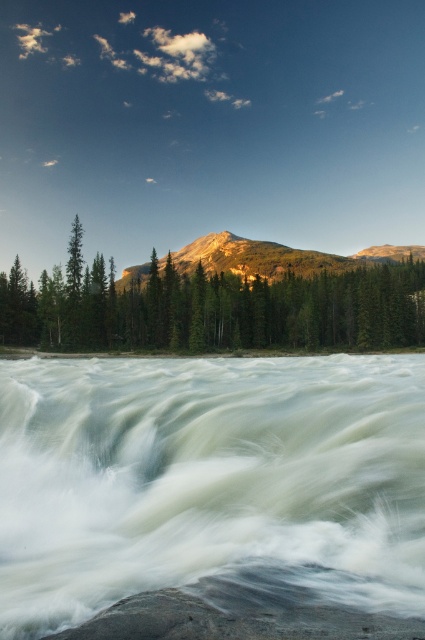
You are a hiker standing at the edge of the rushing river. You see the white frothy water at center and the green matte tree at center. How far apart are these two landmarks?

The white frothy water at center is 61.82 meters away from the green matte tree at center.

You are a hiker planning to cross the river. You see the green matte tree at center and the rocky brown mountain at center in the distance. Which object is wider from your perspective?

The green matte tree at center is narrower than the rocky brown mountain at center, so the rocky brown mountain at center is wider.

You are standing on a safe path observing the scene. There is white frothy water at center and a green matte tree at center. Which object is positioned to the left of the other?

The white frothy water at center is to the left of the green matte tree at center.